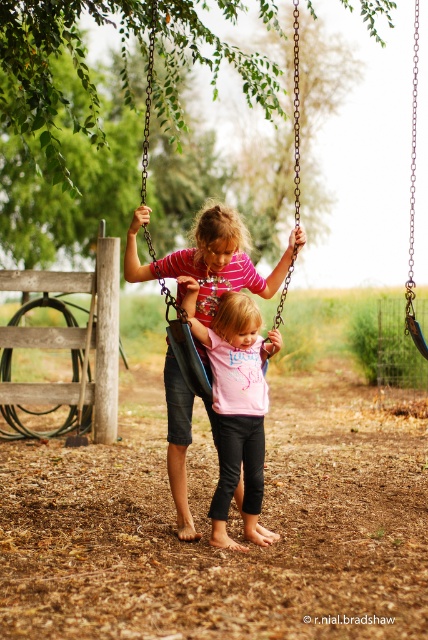
Looking at this image, you are a photographer trying to capture a photo of both points in the scene. You can only focus on one point at a time. If you focus on point (190, 406), will the other point (226, 312) be in focus?

Point (190, 406) is behind point (226, 312). When focusing on the closer object, the further one may not be in focus. Since the photographer focused on the point behind, the other point in front might not be in focus.